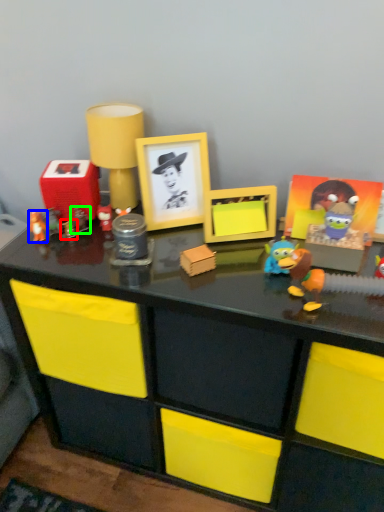
Question: Which object is the farthest from toy (highlighted by a red box)? Choose among these: toy (highlighted by a blue box) or toy (highlighted by a green box).

Choices:
 (A) toy
 (B) toy

Answer: (A)